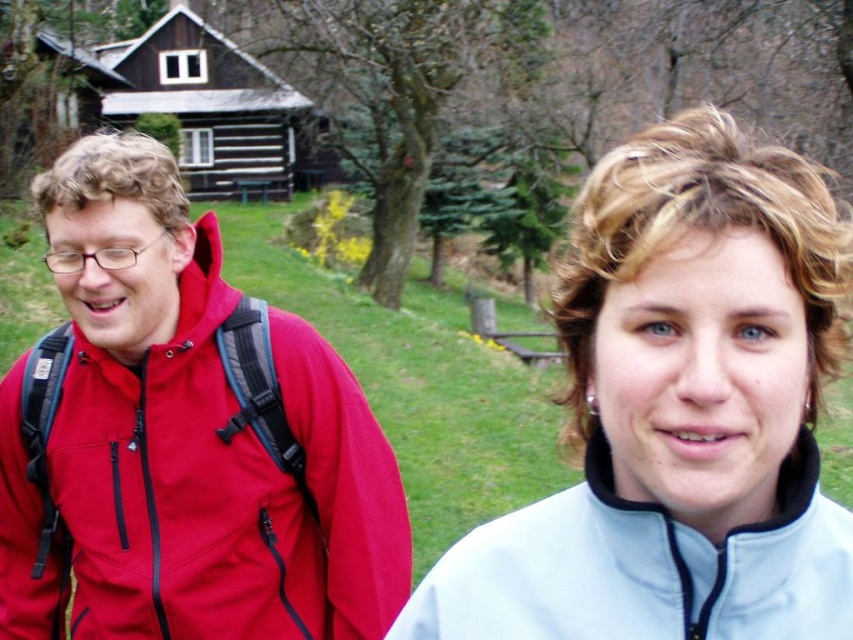
Question: Is light blue fleece jacket at center above matte red jacket at left?

Choices:
 (A) no
 (B) yes

Answer: (B)

Question: Which of the following is the farthest from the observer?

Choices:
 (A) (601, 515)
 (B) (689, 358)
 (C) (215, 561)

Answer: (C)

Question: Does light blue fleece jacket at center have a larger size compared to matte red jacket at left?

Choices:
 (A) yes
 (B) no

Answer: (B)

Question: Which point is farther to the camera?

Choices:
 (A) white fleece sweatshirt at center
 (B) light blue fleece jacket at center

Answer: (A)

Question: Which object appears closest to the camera in this image?

Choices:
 (A) white fleece sweatshirt at center
 (B) matte red jacket at left
 (C) light blue fleece jacket at center

Answer: (C)

Question: Does light blue fleece jacket at center have a larger size compared to white fleece sweatshirt at center?

Choices:
 (A) no
 (B) yes

Answer: (A)